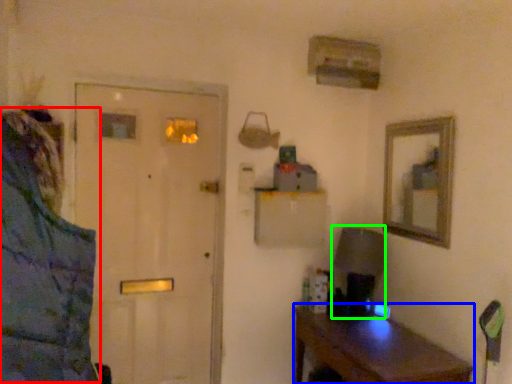
Question: Based on their relative distances, which object is nearer to jacket (highlighted by a red box)? Choose from desk (highlighted by a blue box) and table lamp (highlighted by a green box).

Choices:
 (A) desk
 (B) table lamp

Answer: (A)